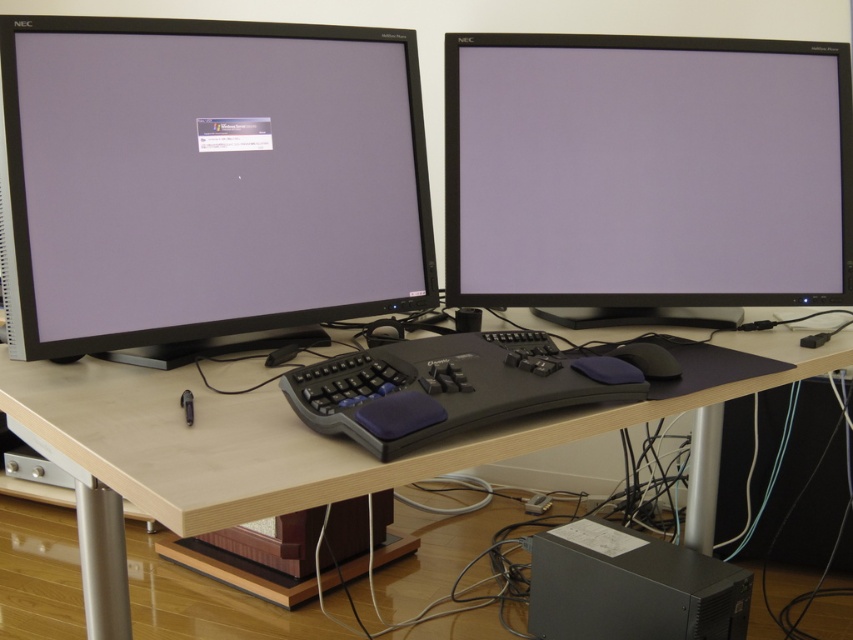
Question: Considering the real-world distances, which object is farthest from the light wood table at center?

Choices:
 (A) matte black monitor at left
 (B) matte black monitor at upper right
 (C) black plastic computer at lower center

Answer: (C)

Question: Can you confirm if light wood table at center is positioned to the left of black rubber mouse at center?

Choices:
 (A) no
 (B) yes

Answer: (B)

Question: Estimate the real-world distances between objects in this image. Which object is farther from the gray rubberized keyboard at center?

Choices:
 (A) matte black monitor at left
 (B) matte black monitor at upper right

Answer: (B)

Question: In this image, where is matte black monitor at upper right located relative to gray rubberized keyboard at center?

Choices:
 (A) left
 (B) right

Answer: (B)

Question: Does black plastic computer at lower center have a larger size compared to black rubber mouse at center?

Choices:
 (A) yes
 (B) no

Answer: (A)

Question: Which object appears closest to the camera in this image?

Choices:
 (A) black plastic computer at lower center
 (B) matte black monitor at left

Answer: (B)